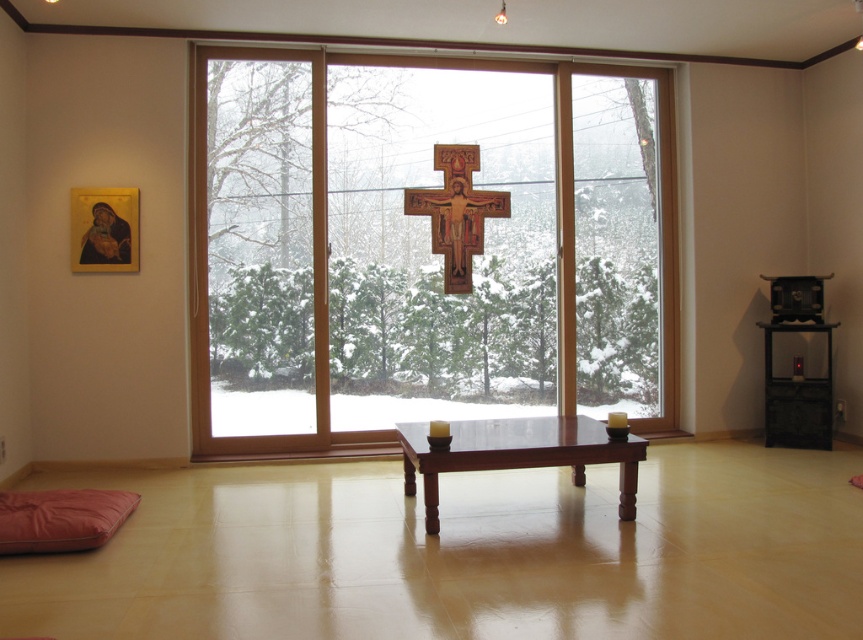
You are an interior designer planning to place a 1.5 meter wide sofa in this room. The sofa must be placed in front of the transparent wood glass door at center. Given the door is wider than the wooden crucifix at center, will the sofa fit in front of the door without blocking the crucifix?

The transparent wood glass door at center is wider than the wooden crucifix at center. Since the sofa is 1.5 meters wide and the door is wider than the crucifix, but we don not know the exact width of the door, it is uncertain if the sofa will fit without blocking the crucifix. More information about the door width is needed.

You are standing in the room and want to see the wooden crucifix at center clearly. What should you do to ensure the transparent wood glass door at center doesn not block your view?

Move closer to the transparent wood glass door at center so that it is between you and the wooden crucifix at center. Since the transparent wood glass door at center is in front of the wooden crucifix at center, moving closer will allow you to look through the door while still seeing the crucifix behind it.

You are a delivery person who needs to place a 3 meter long package between the wooden crucifix at center and the matte pink yoga mat at lower left. Can you fit it there without bending the package?

The distance between the wooden crucifix at center and the matte pink yoga mat at lower left is 2.71 meters, so the 3 meter long package cannot fit there without bending it since it is longer than the available space.